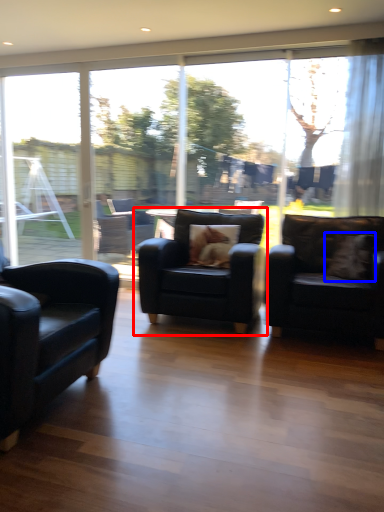
Question: Among these objects, which one is farthest to the camera, chair (highlighted by a red box) or pillow (highlighted by a blue box)?

Choices:
 (A) chair
 (B) pillow

Answer: (B)